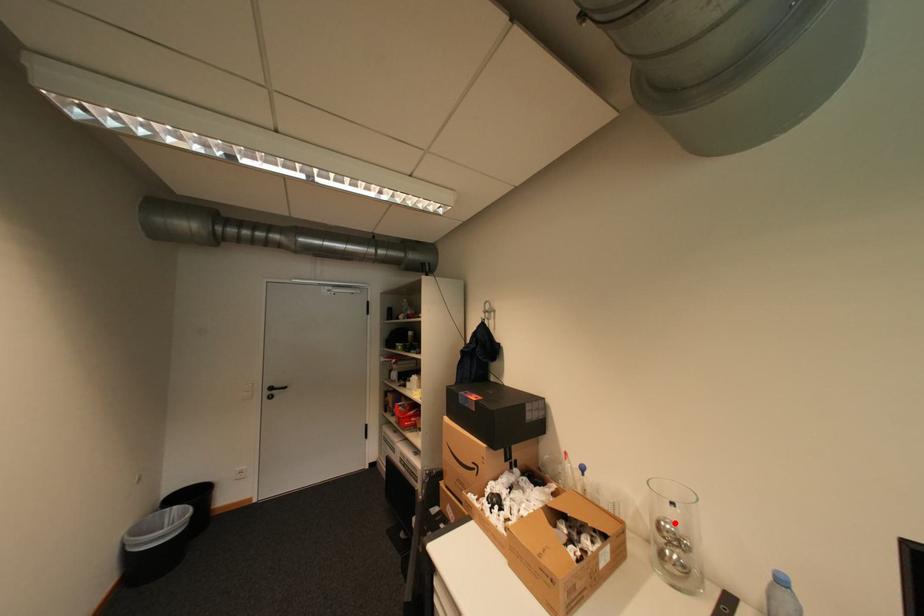
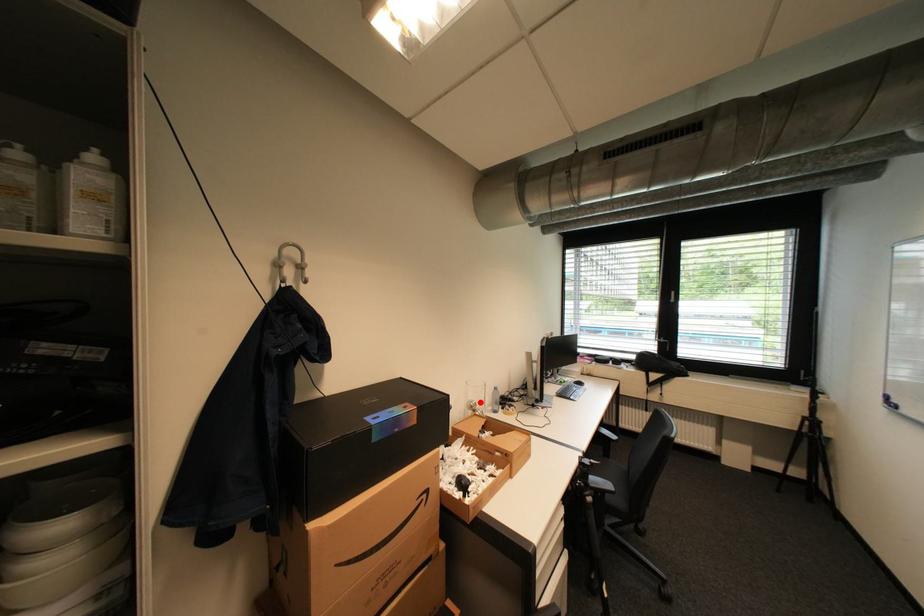
I am providing you with two images of the same scene from different viewpoints. A red point is marked on the first image and another point is marked on the second image. Are the points marked in image1 and image2 representing the same 3D position?

Yes